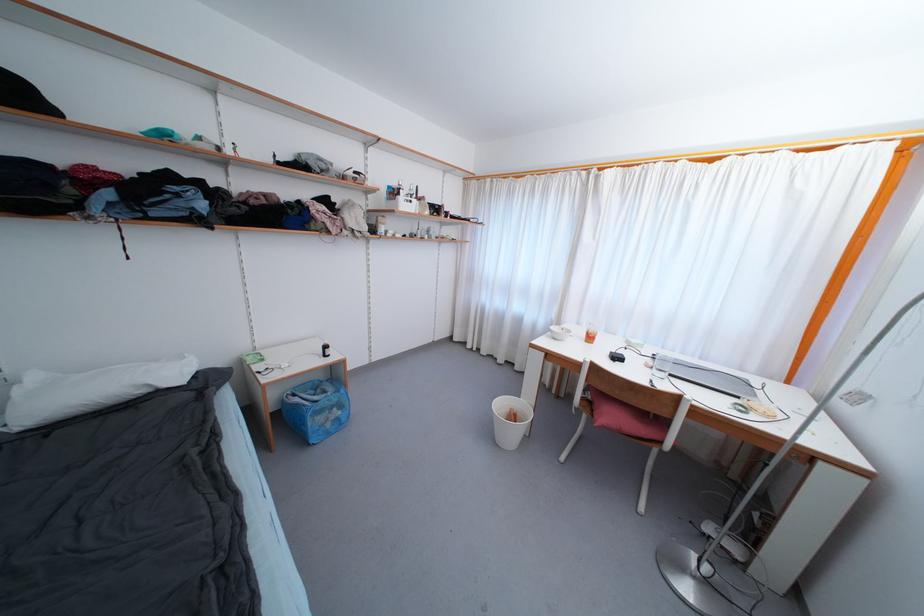
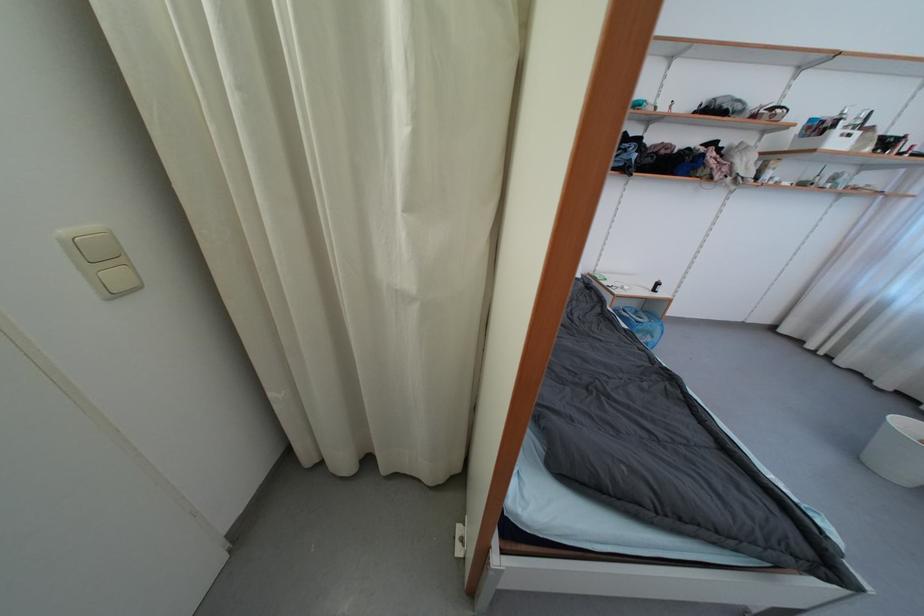
The point at [505,407] is marked in the first image. Where is the corresponding point in the second image?

(912, 428)